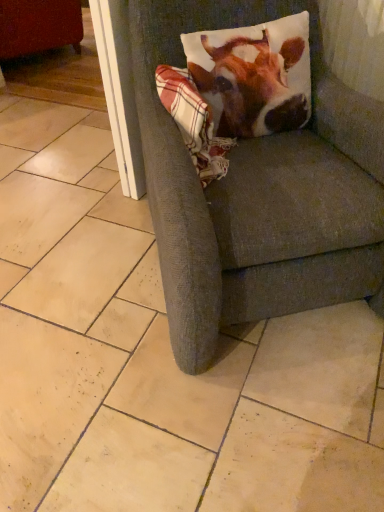
Question: Is matte red swivel chair at upper left taller than plaid fabric at upper right?

Choices:
 (A) yes
 (B) no

Answer: (A)

Question: From a real-world perspective, is matte red swivel chair at upper left under plaid fabric at upper right?

Choices:
 (A) no
 (B) yes

Answer: (B)

Question: From the image's perspective, does matte red swivel chair at upper left appear lower than plaid fabric at upper right?

Choices:
 (A) no
 (B) yes

Answer: (A)

Question: Is matte red swivel chair at upper left thinner than plaid fabric at upper right?

Choices:
 (A) no
 (B) yes

Answer: (A)

Question: Is matte red swivel chair at upper left directly adjacent to plaid fabric at upper right?

Choices:
 (A) yes
 (B) no

Answer: (B)

Question: From the image's perspective, is textured gray armchair at center above or below white glossy screen door at upper left?

Choices:
 (A) above
 (B) below

Answer: (B)

Question: From a real-world perspective, relative to white glossy screen door at upper left, is textured gray armchair at center vertically above or below?

Choices:
 (A) below
 (B) above

Answer: (B)

Question: From their relative heights in the image, would you say textured gray armchair at center is taller or shorter than white glossy screen door at upper left?

Choices:
 (A) tall
 (B) short

Answer: (A)

Question: Is textured gray armchair at center spatially inside white glossy screen door at upper left, or outside of it?

Choices:
 (A) outside
 (B) inside

Answer: (A)

Question: Is point (220, 101) closer or farther from the camera than point (130, 54)?

Choices:
 (A) farther
 (B) closer

Answer: (B)

Question: From a real-world perspective, is printed fabric pillow at upper right physically located above or below white glossy screen door at upper left?

Choices:
 (A) below
 (B) above

Answer: (B)

Question: From the image's perspective, relative to white glossy screen door at upper left, is printed fabric pillow at upper right above or below?

Choices:
 (A) above
 (B) below

Answer: (B)

Question: Considering the positions of printed fabric pillow at upper right and white glossy screen door at upper left in the image, is printed fabric pillow at upper right taller or shorter than white glossy screen door at upper left?

Choices:
 (A) short
 (B) tall

Answer: (A)

Question: In terms of size, does plaid fabric at upper right appear bigger or smaller than matte red swivel chair at upper left?

Choices:
 (A) big
 (B) small

Answer: (B)

Question: From the image's perspective, is plaid fabric at upper right located above or below matte red swivel chair at upper left?

Choices:
 (A) above
 (B) below

Answer: (B)